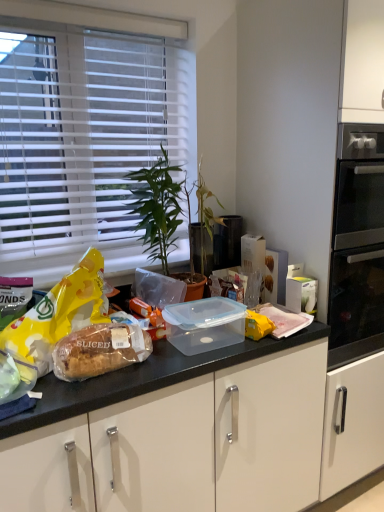
Question: In terms of height, does sliced bread at center look taller or shorter compared to yellow matte snack at left?

Choices:
 (A) tall
 (B) short

Answer: (B)

Question: Is point (64, 339) closer or farther from the camera than point (61, 291)?

Choices:
 (A) closer
 (B) farther

Answer: (A)

Question: Which is nearer to the white plastic blinds at upper left?

Choices:
 (A) black plastic trash can at center
 (B) sliced bread at center
 (C) green leafy plant at center
 (D) yellow matte snack at left

Answer: (C)

Question: Which object is positioned closest to the green leafy plant at center?

Choices:
 (A) sliced bread at center
 (B) white plastic blinds at upper left
 (C) black plastic trash can at center
 (D) yellow matte snack at left

Answer: (B)